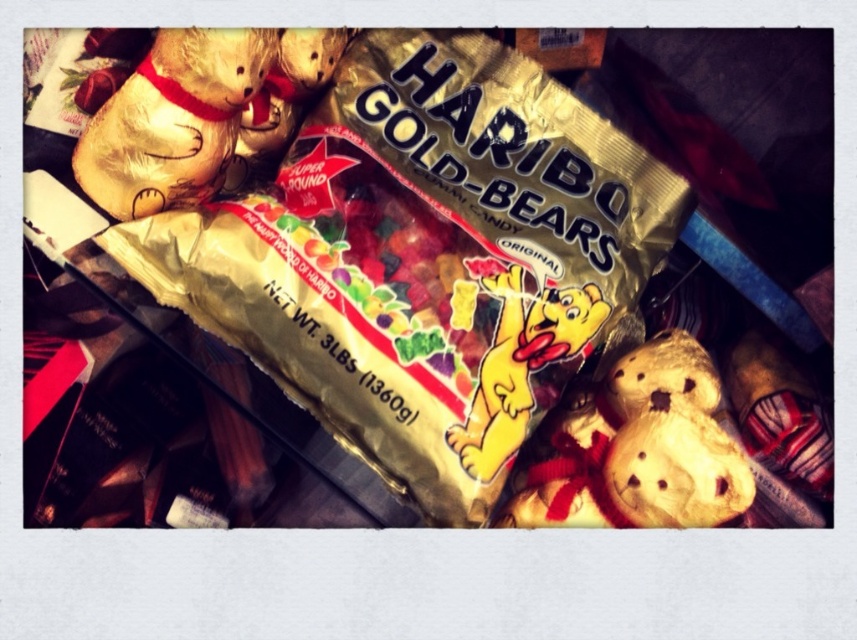
Question: From the image, what is the correct spatial relationship of matte gold plush bear at lower right in relation to yellow paper bear at center?

Choices:
 (A) right
 (B) left

Answer: (A)

Question: Which point is closer to the camera?

Choices:
 (A) yellow paper bear at center
 (B) matte gold plush bear at lower right

Answer: (B)

Question: Where is matte gold plush bear at lower right located in relation to yellow paper bear at center in the image?

Choices:
 (A) right
 (B) left

Answer: (A)

Question: Among these objects, which one is nearest to the camera?

Choices:
 (A) yellow paper bear at center
 (B) gold foil bear at upper left
 (C) matte gold plush bear at lower right

Answer: (B)

Question: Does matte gold plush bear at lower right come behind gold foil bear at upper left?

Choices:
 (A) yes
 (B) no

Answer: (A)

Question: Which object is the farthest from the matte gold plush bear at lower right?

Choices:
 (A) gold foil bear at upper left
 (B) yellow paper bear at center

Answer: (A)